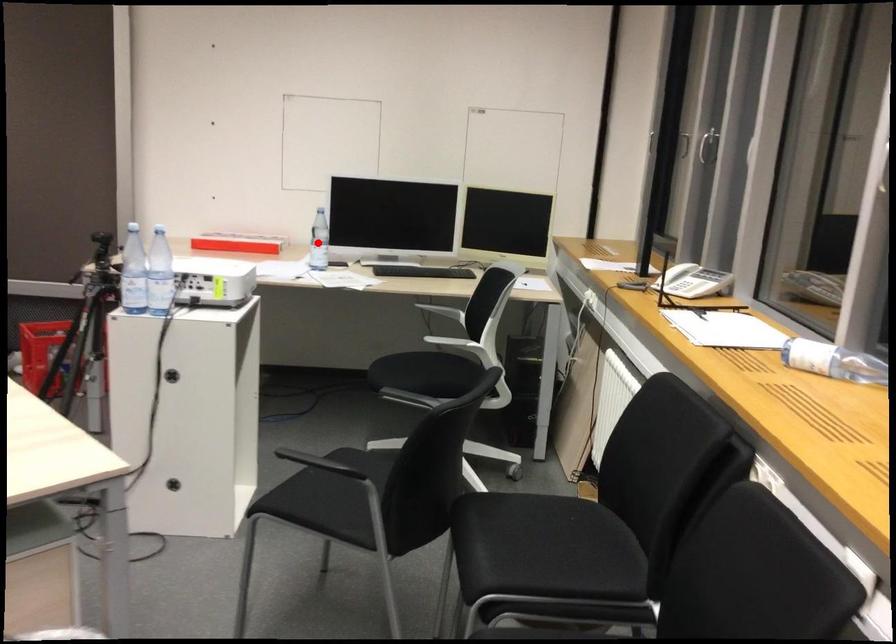
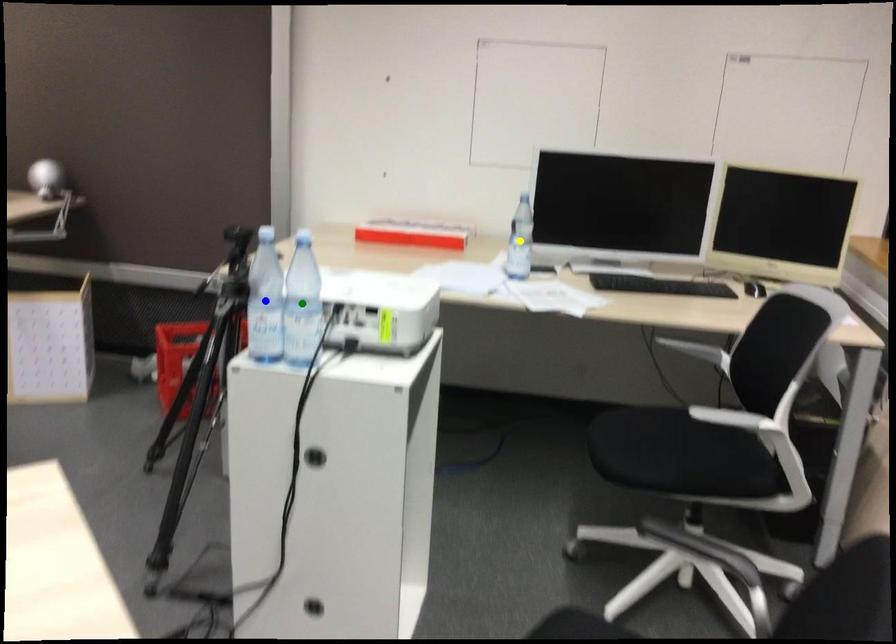
Question: I am providing you with two images of the same scene from different viewpoints. A red point is marked on the first image. You are given multiple points on the second image. Which mark in image 2 goes with the point in image 1?

Choices:
 (A) green point
 (B) yellow point
 (C) blue point

Answer: (B)